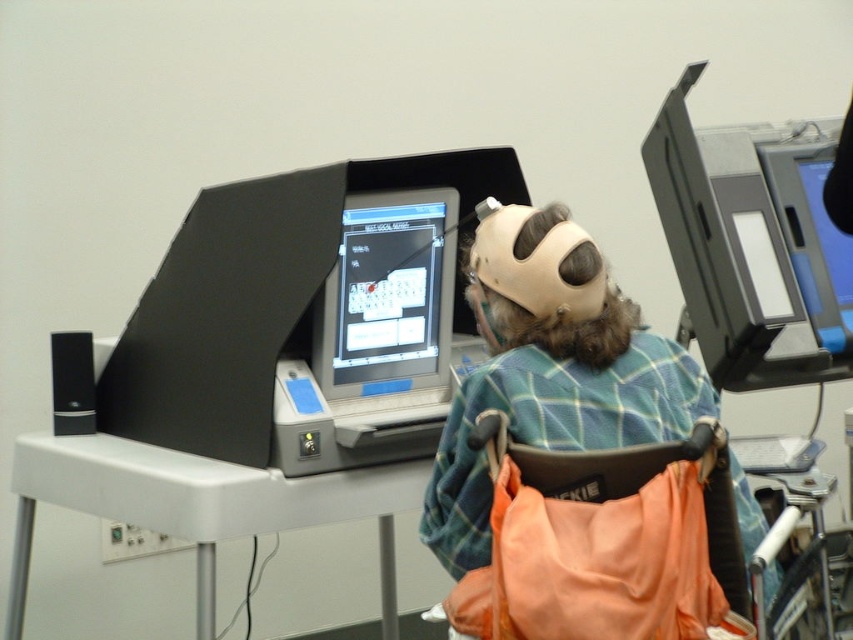
Measure the distance between white plastic computer desk at lower left and camera.

white plastic computer desk at lower left and camera are 1.77 meters apart from each other.

Who is more forward, (184, 481) or (448, 195)?

Point (184, 481) is more forward.

Where is `white plastic computer desk at lower left`? Image resolution: width=853 pixels, height=640 pixels. white plastic computer desk at lower left is located at coordinates (199, 504).

Between white plastic computer desk at lower left and matte plastic monitor at upper right, which one appears on the left side from the viewer's perspective?

white plastic computer desk at lower left

Does point (24, 588) come farther from viewer compared to point (842, 266)?

No, (24, 588) is in front of (842, 266).

At what (x,y) coordinates should I click in order to perform the action: click on white plastic computer desk at lower left. Please return your answer as a coordinate pair (x, y). The width and height of the screenshot is (853, 640). Looking at the image, I should click on click(x=199, y=504).

This screenshot has height=640, width=853. Find the location of `plaid fabric shirt at center`. plaid fabric shirt at center is located at coordinates pos(555,406).

Is point (605, 330) positioned in front of point (445, 209)?

Yes, it is in front of point (445, 209).

Locate an element on the screen. plaid fabric shirt at center is located at coordinates (555, 406).